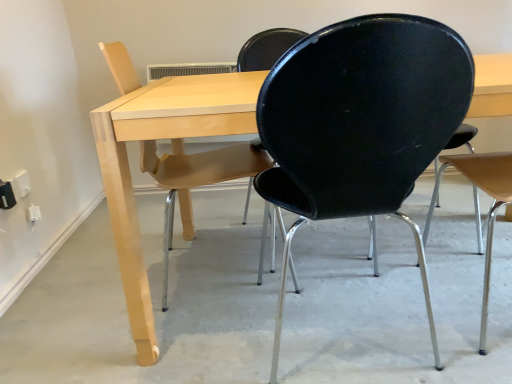
Image resolution: width=512 pixels, height=384 pixels. I want to click on vacant space to the left of black matte chair at right, positioned as the first chair in right-to-left order, so (x=411, y=306).